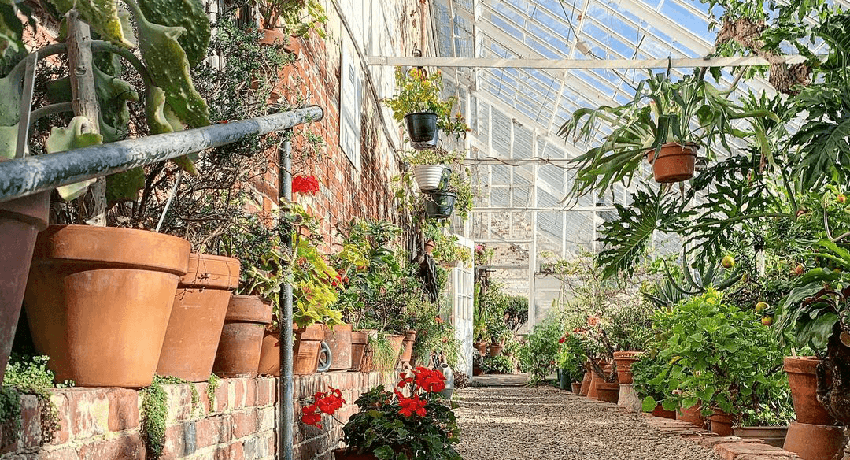
Where is `terracotta plastic pot`? Image resolution: width=850 pixels, height=460 pixels. terracotta plastic pot is located at coordinates (673, 169).